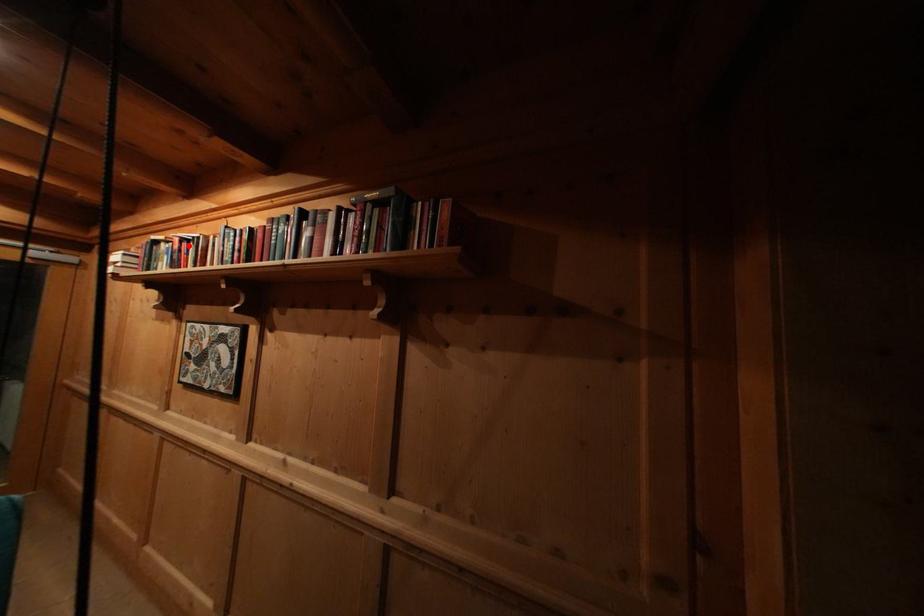
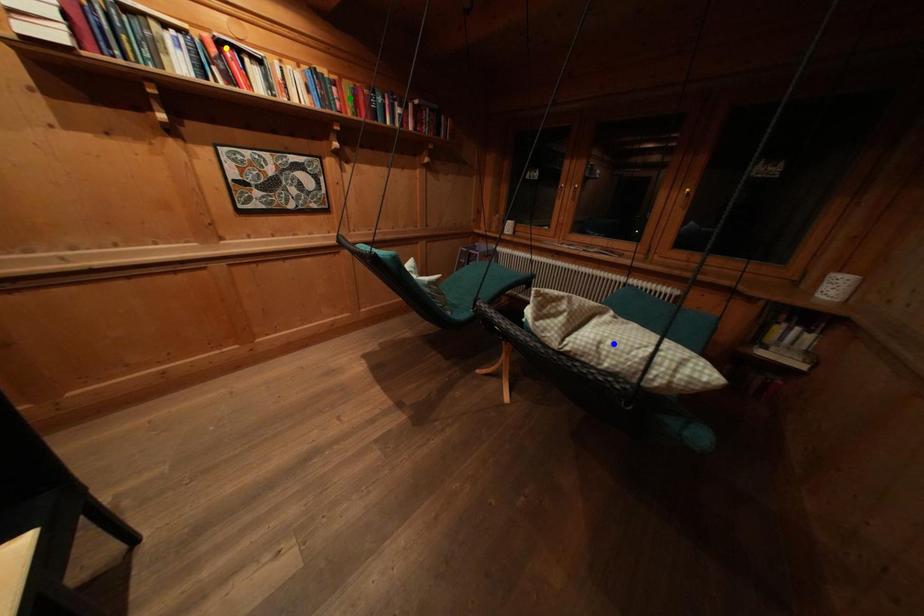
Question: I am providing you with two images of the same scene from different viewpoints. A red point is marked on the first image. You are given multiple points on the second image. Can you choose the point in image 2 that corresponds to the point in image 1?

Choices:
 (A) green point
 (B) yellow point
 (C) blue point

Answer: (B)